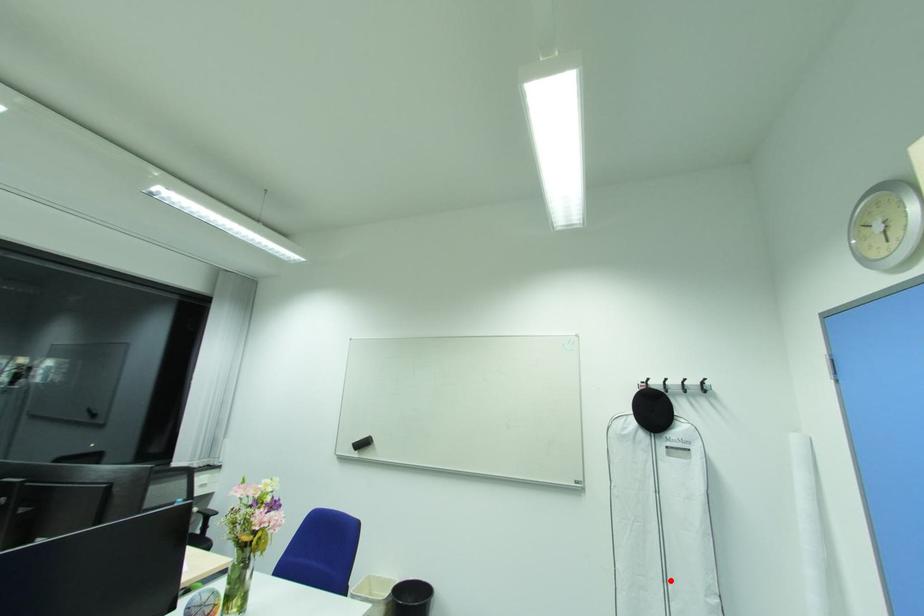
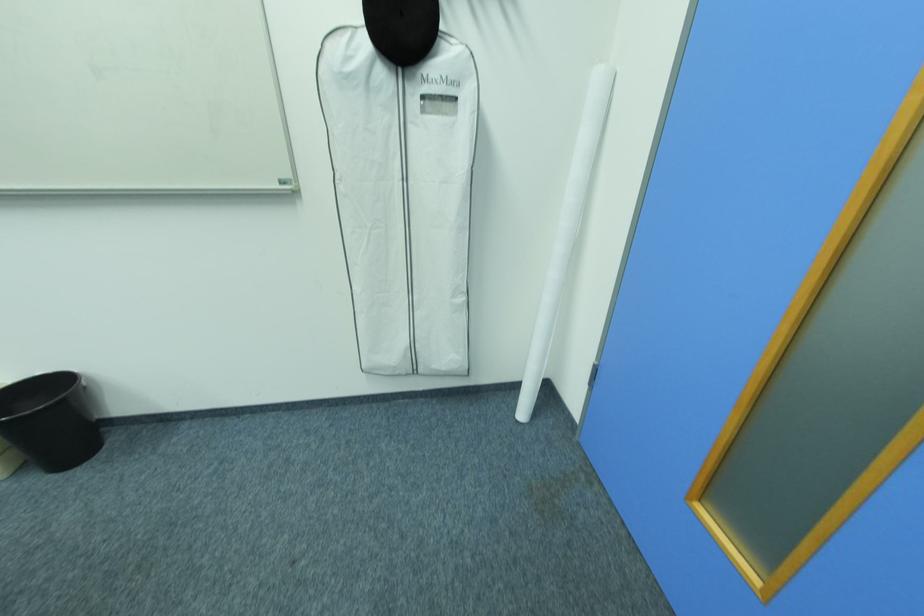
Question: I am providing you with two images of the same scene from different viewpoints. A red point is marked on the first image. Is the red point's position out of view in image 2?

Choices:
 (A) Yes
 (B) No

Answer: (B)